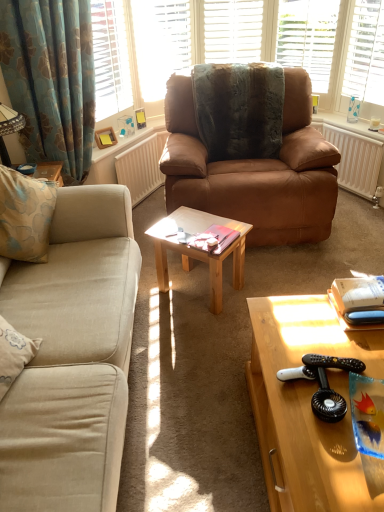
You are a GUI agent. You are given a task and a screenshot of the screen. Output one action in this format:
    pyautogui.click(x=<x>, y=<y>)
    Task: Click on the vacant space in front of light brown wooden table at center, the second coffee table when ordered from bottom to top
    This screenshot has height=512, width=384.
    Given the screenshot: What is the action you would take?
    pyautogui.click(x=196, y=333)